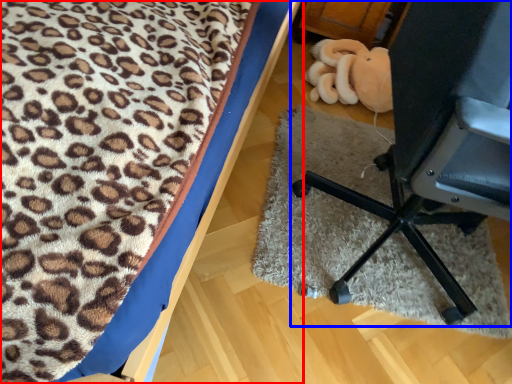
Question: Among these objects, which one is farthest to the camera, furniture (highlighted by a red box) or furniture (highlighted by a blue box)?

Choices:
 (A) furniture
 (B) furniture

Answer: (B)